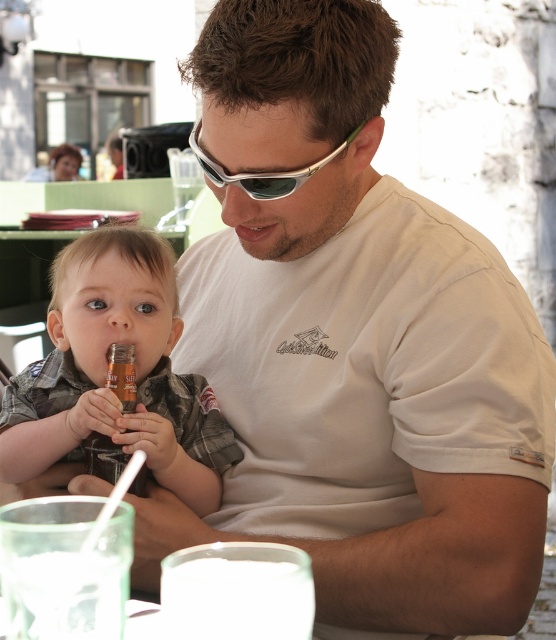
Question: From the image, what is the correct spatial relationship of matte plastic bottle at left in relation to silver metallic sunglasses at center?

Choices:
 (A) above
 (B) below

Answer: (B)

Question: Does matte plastic bottle at left have a smaller size compared to silver metallic sunglasses at center?

Choices:
 (A) yes
 (B) no

Answer: (B)

Question: Which object is farther from the camera taking this photo?

Choices:
 (A) silver metallic sunglasses at center
 (B) matte plastic bottle at left

Answer: (B)

Question: Does matte plastic bottle at left come behind silver metallic sunglasses at center?

Choices:
 (A) no
 (B) yes

Answer: (B)

Question: Among these points, which one is farthest from the camera?

Choices:
 (A) (261, 180)
 (B) (101, 403)

Answer: (B)